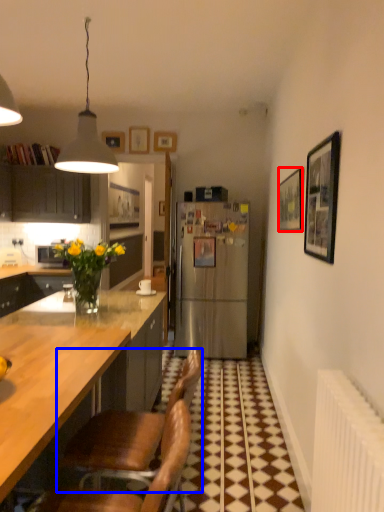
Question: Among these objects, which one is farthest to the camera, picture frame (highlighted by a red box) or chair (highlighted by a blue box)?

Choices:
 (A) picture frame
 (B) chair

Answer: (A)